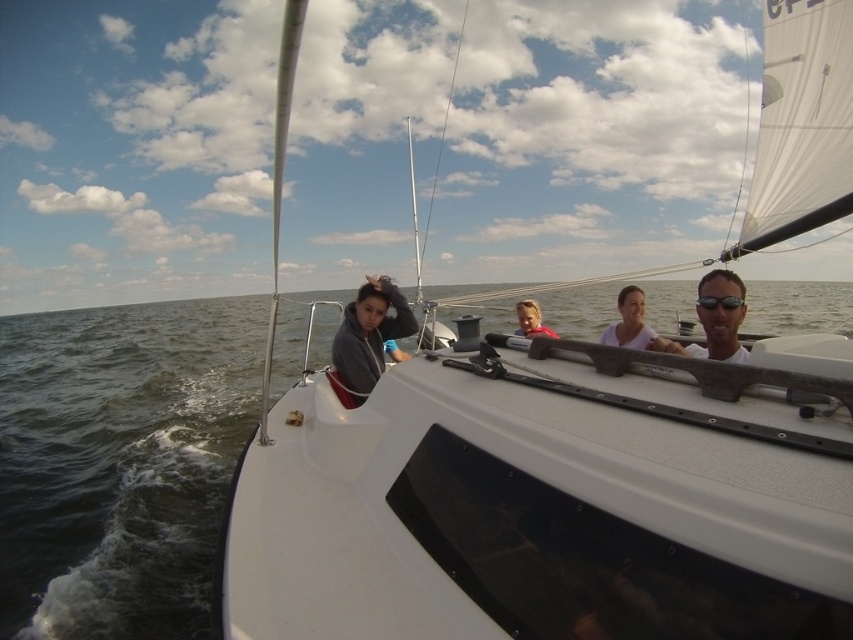
You are a photographer trying to capture a photo of the gray fleece jacket at center and the dark gray water at center. Which object will appear bigger in your photo?

The dark gray water at center is larger in size than the gray fleece jacket at center, so it will appear bigger in the photo.

You are a photographer trying to capture the person with smooth tan skin at center. Based on their position on the boat, where should you aim your camera to ensure their skin is in focus?

The smooth tan skin at center is located at point [531,320], so aim your camera towards the center of the boat slightly towards the lower half to capture their skin in focus.

You are a photographer trying to capture a clear shot of the gray fleece jacket at center and the white matte sunglasses at upper right. Since you want to focus on the jacket first, which object should you adjust your camera to focus on first based on their sizes?

The gray fleece jacket at center has a greater height compared to the white matte sunglasses at upper right, so you should focus on the gray fleece jacket at center first as it is larger.